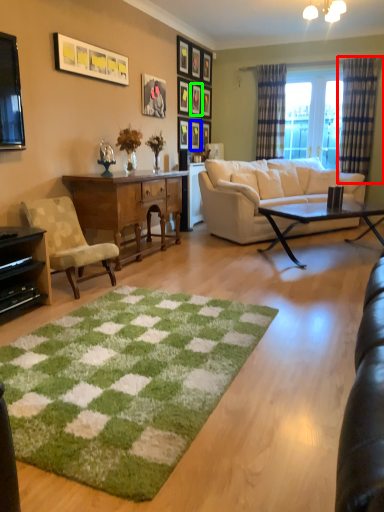
Question: Based on their relative distances, which object is farther from curtain (highlighted by a red box)? Choose from picture frame (highlighted by a blue box) and picture frame (highlighted by a green box).

Choices:
 (A) picture frame
 (B) picture frame

Answer: (A)